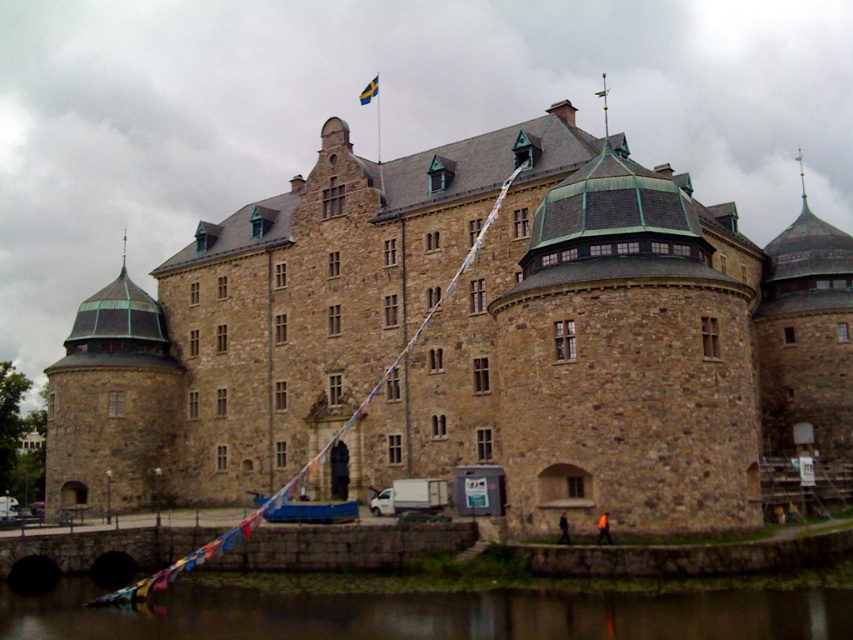
Is brown stone castle at center smaller than brown stone building at center?

Actually, brown stone castle at center might be larger than brown stone building at center.

Can you confirm if brown stone castle at center is positioned below brown stone building at center?

Incorrect, brown stone castle at center is not positioned below brown stone building at center.

Is point (407, 260) closer to viewer compared to point (294, 481)?

That is True.

You are a GUI agent. You are given a task and a screenshot of the screen. Output one action in this format:
    pyautogui.click(x=<x>, y=<y>)
    Task: Click on the brown stone castle at center
    
    Given the screenshot: What is the action you would take?
    pyautogui.click(x=467, y=340)

Between green leafy water at lower center and brown stone building at center, which one appears on the right side from the viewer's perspective?

Positioned to the right is brown stone building at center.

Is point (467, 605) positioned behind point (352, 413)?

No, (467, 605) is in front of (352, 413).

Does point (281, 595) lie in front of point (299, 474)?

Yes, point (281, 595) is closer to viewer.

The width and height of the screenshot is (853, 640). I want to click on green leafy water at lower center, so click(433, 612).

Which is in front, point (759, 509) or point (67, 602)?

Point (759, 509)

The width and height of the screenshot is (853, 640). What do you see at coordinates (467, 340) in the screenshot?
I see `brown stone castle at center` at bounding box center [467, 340].

The width and height of the screenshot is (853, 640). Find the location of `brown stone castle at center`. brown stone castle at center is located at coordinates (467, 340).